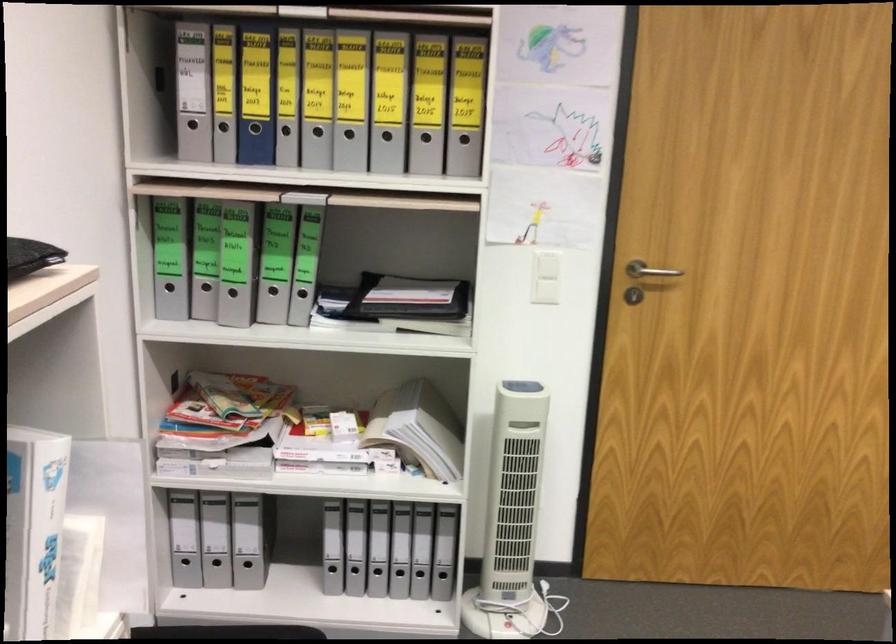
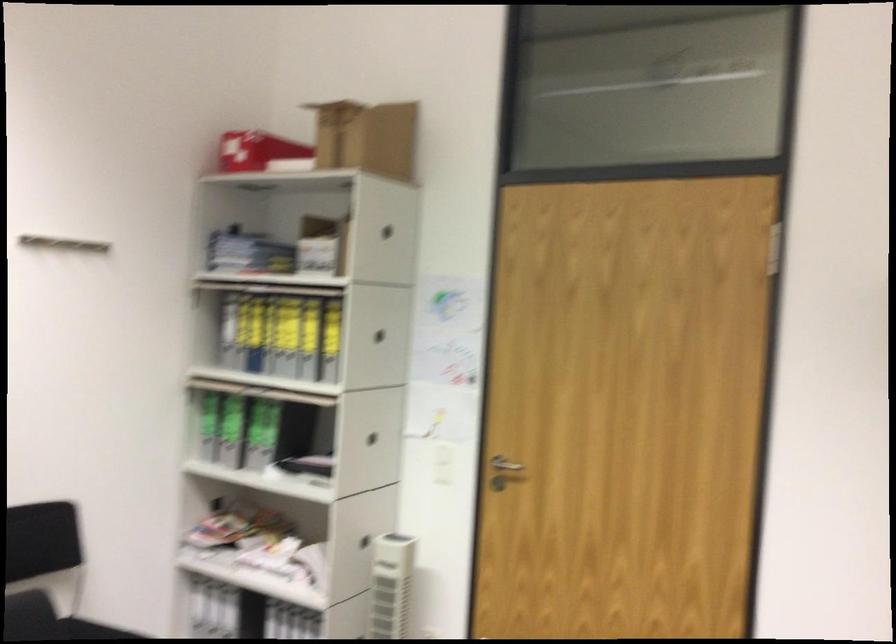
Locate, in the second image, the point that corresponds to the point at 483,259 in the first image.

(372, 438)